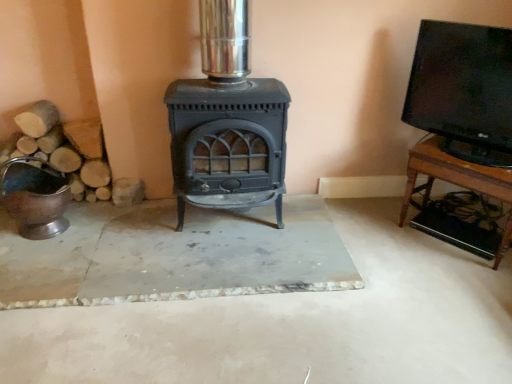
Locate an element on the screen. The width and height of the screenshot is (512, 384). free point below black glossy tv at upper right (from a real-world perspective) is located at coordinates (468, 152).